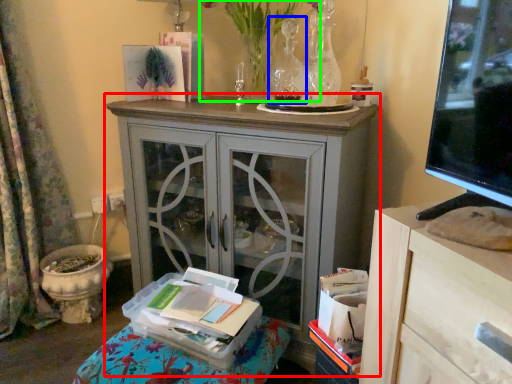
Question: Considering the real-world distances, which object is farthest from cabinetry (highlighted by a red box)? vase (highlighted by a blue box) or floral arrangement (highlighted by a green box)?

Choices:
 (A) vase
 (B) floral arrangement

Answer: (A)